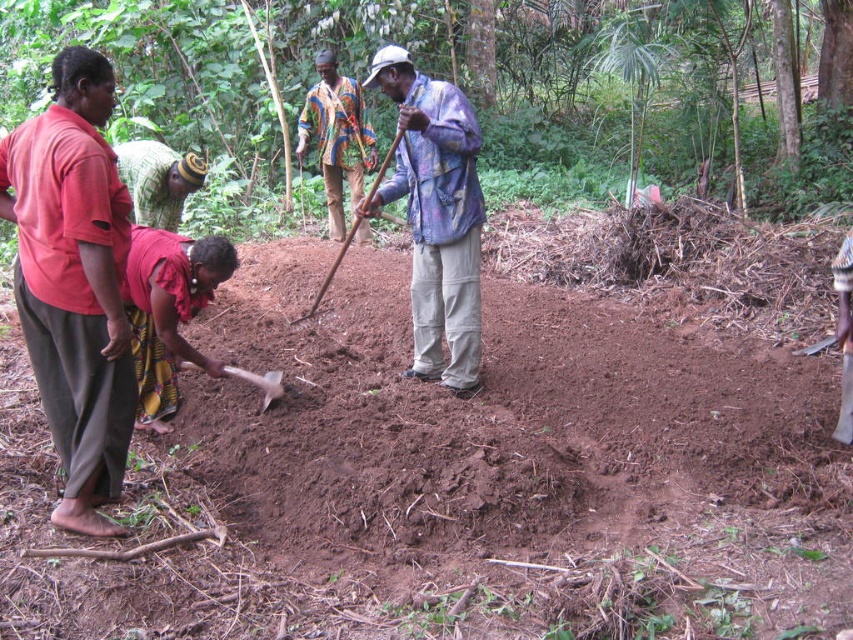
You are standing in the middle of the trench and want to reach the point marked at coordinates (367, 461). Considering the trench is 10 feet wide, can you walk directly to that point without stepping out of the trench?

The point marked at coordinates (367, 461) is 13.27 feet away from the viewer. Since the trench is only 10 feet wide, you would need to step outside the trench to reach it.

You are a farmer planning to plant crops in the trench. The trench has brown soil at center and there is a matte red shirt at left. Which object takes up more space in the scene?

The brown soil at center takes up more space in the scene because it is larger in size than the matte red shirt at left.

You are standing in the rural area and see the brown soil at center and the matte red shirt at left. Which object is positioned to the right of the other?

The brown soil at center is to the right of the matte red shirt at left.